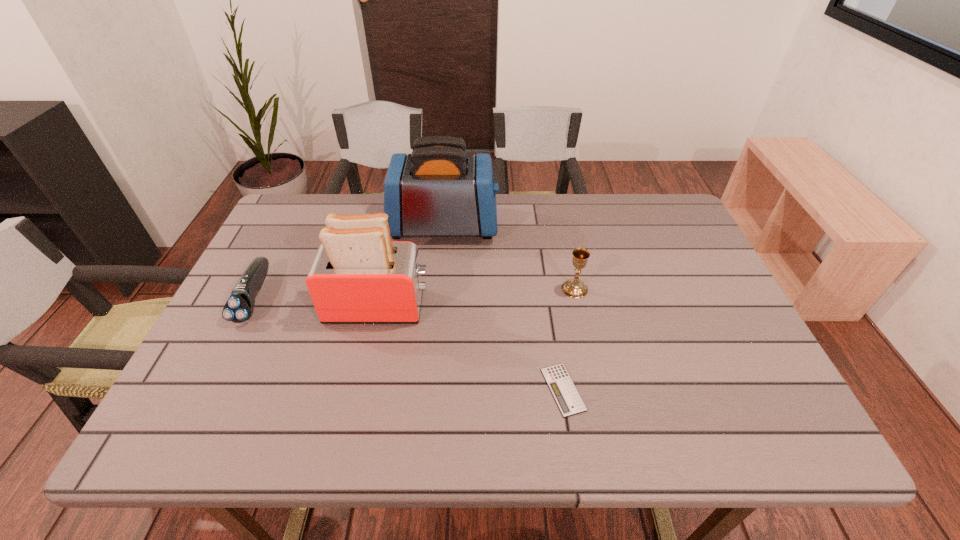
You are a GUI agent. You are given a task and a screenshot of the screen. Output one action in this format:
    pyautogui.click(x=<x>, y=<y>)
    Task: Click on the farther toaster
    This screenshot has width=960, height=540.
    Given the screenshot: What is the action you would take?
    pyautogui.click(x=439, y=190)

Locate an element on the screen. The width and height of the screenshot is (960, 540). the nearer toaster is located at coordinates (359, 276).

The image size is (960, 540). Find the location of `the third shortest object`. the third shortest object is located at coordinates (574, 288).

The image size is (960, 540). Find the location of `the leftmost object`. the leftmost object is located at coordinates (239, 307).

What are the coordinates of `electric shaver` in the screenshot? It's located at (239, 307).

The height and width of the screenshot is (540, 960). I want to click on the shortest object, so click(x=565, y=394).

Image resolution: width=960 pixels, height=540 pixels. I want to click on calculator, so click(565, 394).

The height and width of the screenshot is (540, 960). Find the location of `blank area located 0.310m on the front-facing side of the farthest object`. blank area located 0.310m on the front-facing side of the farthest object is located at coordinates (599, 225).

Locate an element on the screen. Image resolution: width=960 pixels, height=540 pixels. vacant space located on the front-facing side of the nearer toaster is located at coordinates (521, 306).

This screenshot has height=540, width=960. Identify the location of blank area located on the back of the chalice. (557, 206).